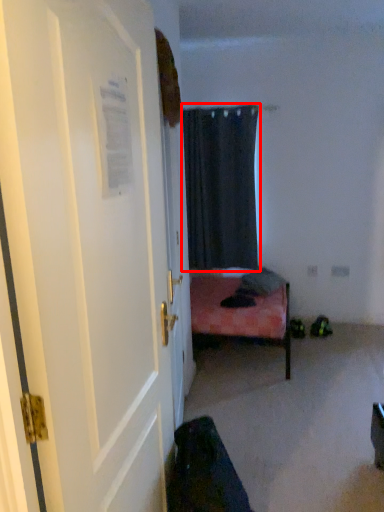
Question: From the image's perspective, where is curtain (annotated by the red box) located relative to door?

Choices:
 (A) below
 (B) above

Answer: (B)